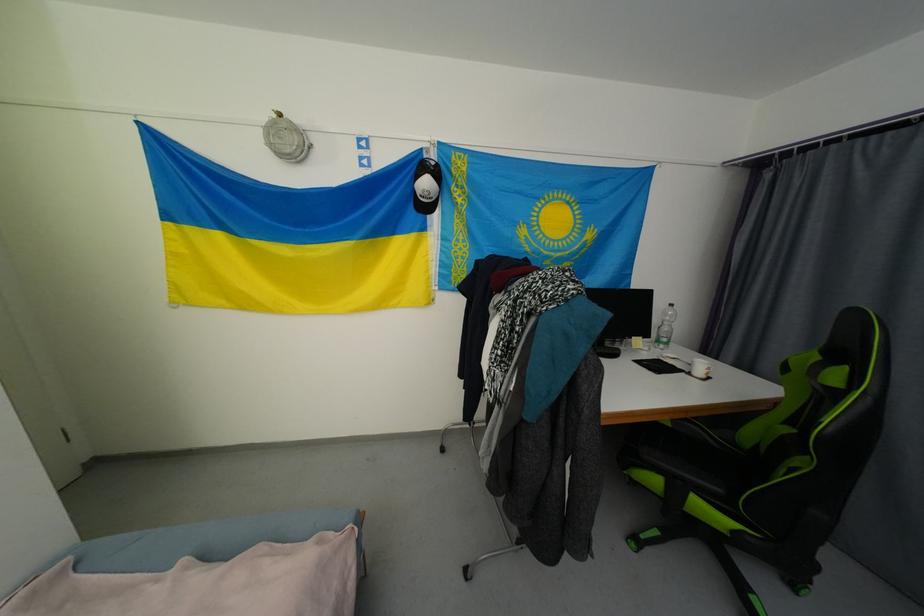
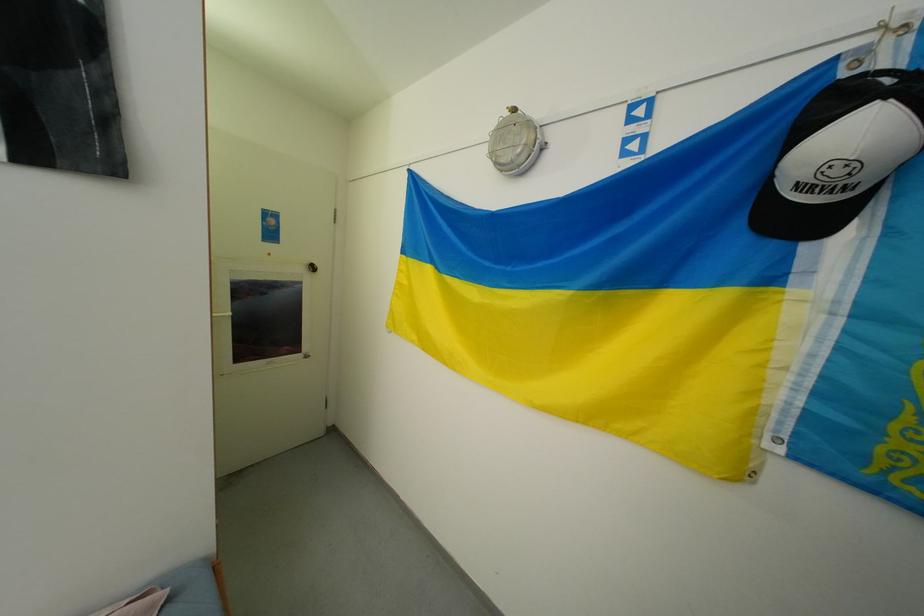
Question: How did the camera likely rotate?

Choices:
 (A) Left
 (B) Right
 (C) Up
 (D) Down

Answer: (A)